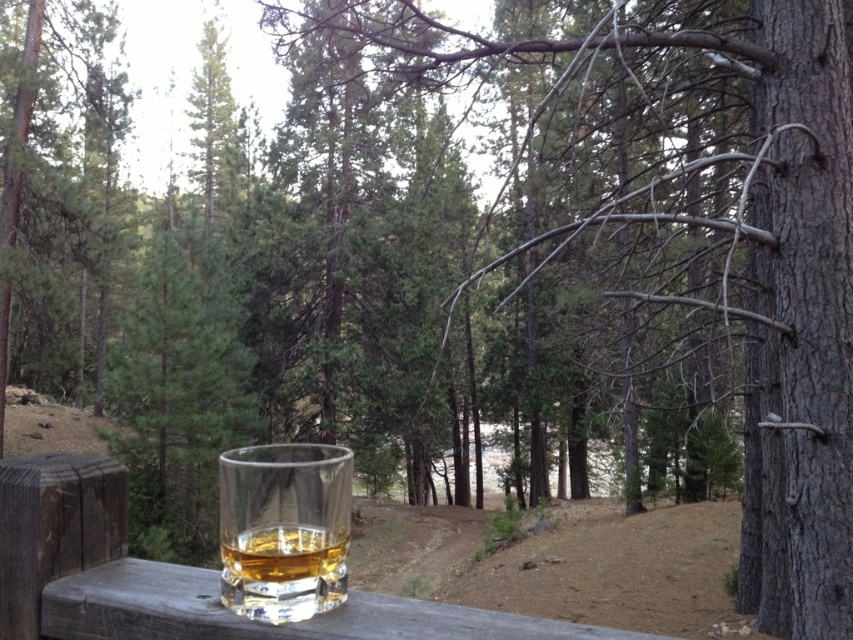
Does green matte tree at center appear over translucent glass at lower center?

No.

Is green matte tree at center to the right of translucent glass at lower center from the viewer's perspective?

No, green matte tree at center is not to the right of translucent glass at lower center.

Measure the distance between point (x=184, y=556) and camera.

Point (x=184, y=556) and camera are 6.88 meters apart from each other.

Locate an element on the screen. green matte tree at center is located at coordinates (178, 388).